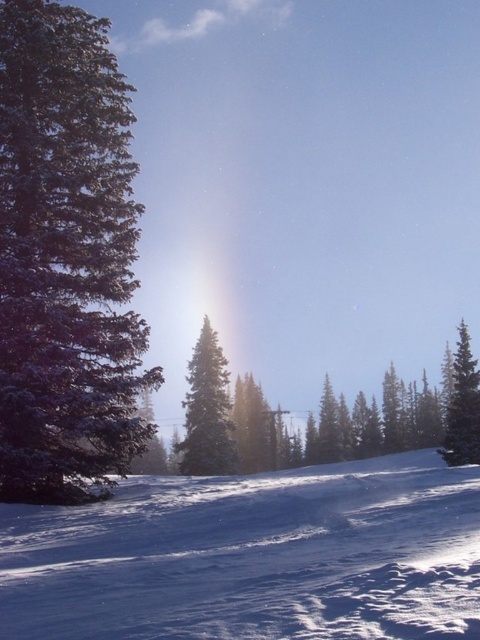
You are an observer standing in the winter landscape. You notice the white powdery snow at center and the green matte evergreen tree at center. Which object is positioned higher in the scene?

The white powdery snow at center is above the green matte evergreen tree at center, so it is positioned higher in the scene.

What is the 2D coordinate of the green matte evergreen tree at left in the image?

The green matte evergreen tree at left is located at the 2D coordinate of point [67,259].